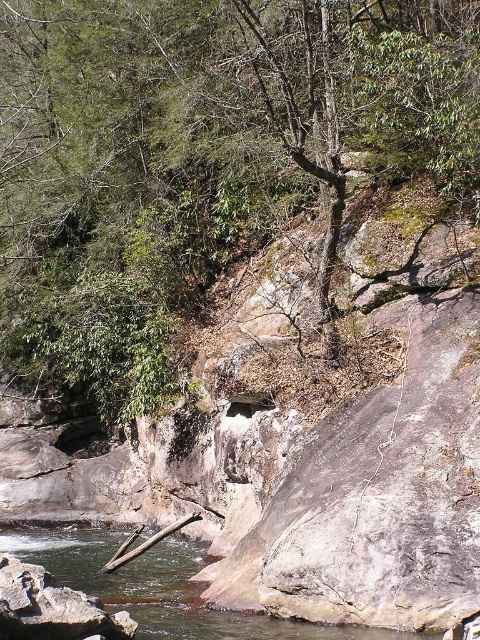
Who is shorter, green leafy tree at upper center or clear water at stream center?

Standing shorter between the two is clear water at stream center.

Between green leafy tree at upper center and clear water at stream center, which one appears on the left side from the viewer's perspective?

green leafy tree at upper center is more to the left.

In order to click on green leafy tree at upper center in this screenshot , I will do `click(199, 157)`.